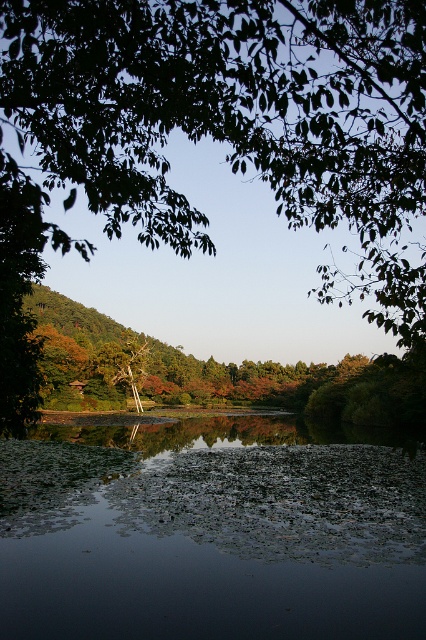
Looking at this image, you are standing at the edge of the water and want to take a photo of both the green leafy tree at upper center and the smooth brown tree trunk at center. Which tree should you focus on first if you want to capture both in the frame?

You should focus on the green leafy tree at upper center first because it is taller than the smooth brown tree trunk at center, so it will require more space in the frame to capture fully.

You are an artist sketching the scene and want to ensure proportions are accurate. Which object should you draw wider between the green leafy tree at upper center and the smooth brown tree trunk at center?

The green leafy tree at upper center should be drawn wider because its width is larger than the smooth brown tree trunk at center.